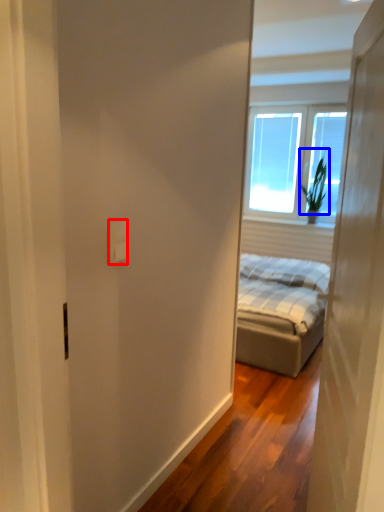
Question: Among these objects, which one is nearest to the camera, electric outlet (highlighted by a red box) or plant (highlighted by a blue box)?

Choices:
 (A) electric outlet
 (B) plant

Answer: (A)